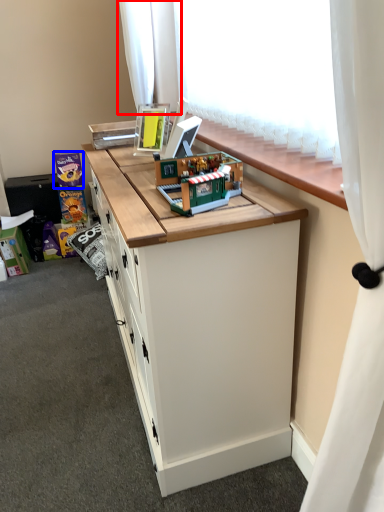
Question: Which object is further to the camera taking this photo, curtain (highlighted by a red box) or toy (highlighted by a blue box)?

Choices:
 (A) curtain
 (B) toy

Answer: (B)